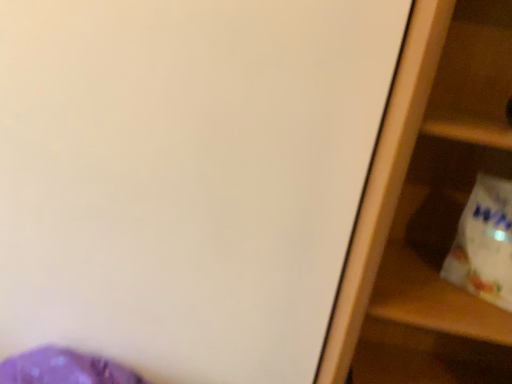
Question: Is wooden shelf at right facing away from white plastic grocery bag at right?

Choices:
 (A) yes
 (B) no

Answer: (A)

Question: Considering the relative positions of wooden shelf at right and white plastic grocery bag at right in the image provided, is wooden shelf at right to the left of white plastic grocery bag at right from the viewer's perspective?

Choices:
 (A) yes
 (B) no

Answer: (A)

Question: Is wooden shelf at right at the right side of white plastic grocery bag at right?

Choices:
 (A) yes
 (B) no

Answer: (B)

Question: Does wooden shelf at right have a larger size compared to white plastic grocery bag at right?

Choices:
 (A) no
 (B) yes

Answer: (B)

Question: Can you confirm if wooden shelf at right is thinner than white plastic grocery bag at right?

Choices:
 (A) yes
 (B) no

Answer: (B)

Question: Does wooden shelf at right turn towards white plastic grocery bag at right?

Choices:
 (A) yes
 (B) no

Answer: (A)

Question: Would you say wooden shelf at right is part of white plastic grocery bag at right's contents?

Choices:
 (A) no
 (B) yes

Answer: (A)

Question: Is white plastic grocery bag at right further to camera compared to wooden shelf at right?

Choices:
 (A) yes
 (B) no

Answer: (A)

Question: Can you confirm if white plastic grocery bag at right is taller than wooden shelf at right?

Choices:
 (A) no
 (B) yes

Answer: (A)

Question: Is white plastic grocery bag at right closer to the viewer compared to wooden shelf at right?

Choices:
 (A) yes
 (B) no

Answer: (B)

Question: From the image's perspective, is white plastic grocery bag at right on wooden shelf at right?

Choices:
 (A) yes
 (B) no

Answer: (A)

Question: From a real-world perspective, is white plastic grocery bag at right located higher than wooden shelf at right?

Choices:
 (A) no
 (B) yes

Answer: (B)

Question: Is point (457, 233) positioned closer to the camera than point (504, 26)?

Choices:
 (A) closer
 (B) farther

Answer: (B)